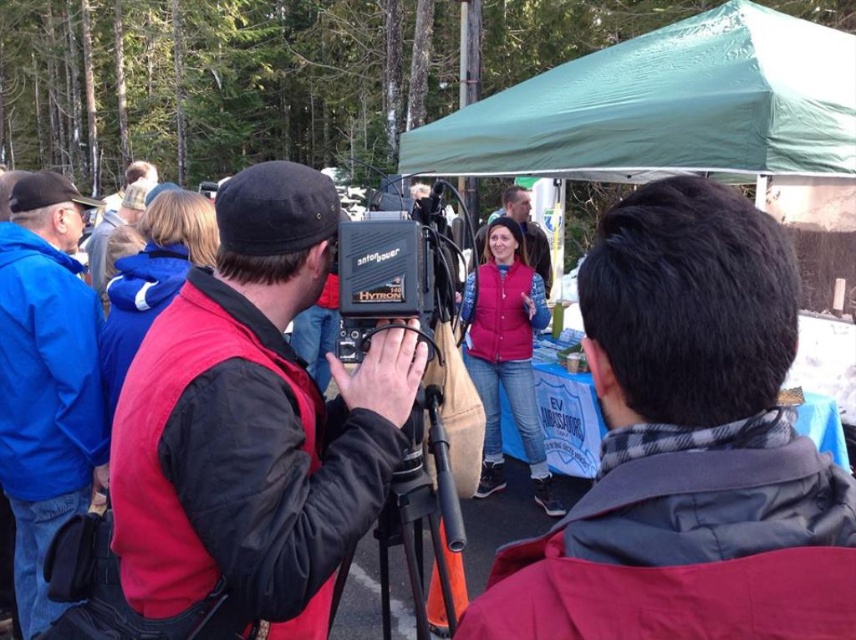
Question: From the image, what is the correct spatial relationship of blue fleece jacket at left in relation to matte black vest at center?

Choices:
 (A) right
 (B) left

Answer: (B)

Question: Which point is farther to the camera?

Choices:
 (A) (9, 429)
 (B) (413, 406)

Answer: (A)

Question: Does black matte tripod at center have a lesser width compared to matte black vest at center?

Choices:
 (A) yes
 (B) no

Answer: (A)

Question: Which of the following is the closest to the observer?

Choices:
 (A) green fabric canopy at upper center
 (B) matte black vest at center

Answer: (A)

Question: Does blue fleece jacket at left have a lesser width compared to black matte tripod at center?

Choices:
 (A) yes
 (B) no

Answer: (B)

Question: Estimate the real-world distances between objects in this image. Which object is closer to the green fabric canopy at upper center?

Choices:
 (A) blue fleece jacket at left
 (B) matte black camera at center
 (C) black matte tripod at center

Answer: (B)